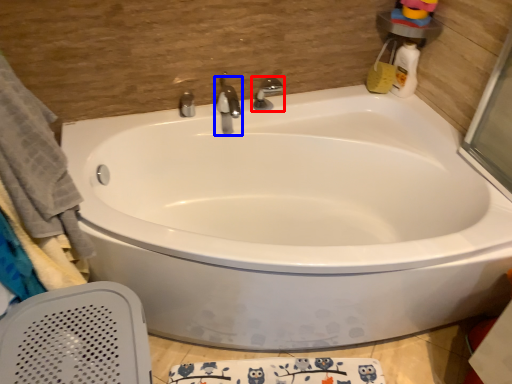
Question: Which of the following is the farthest to the observer, tap (highlighted by a red box) or tap (highlighted by a blue box)?

Choices:
 (A) tap
 (B) tap

Answer: (A)